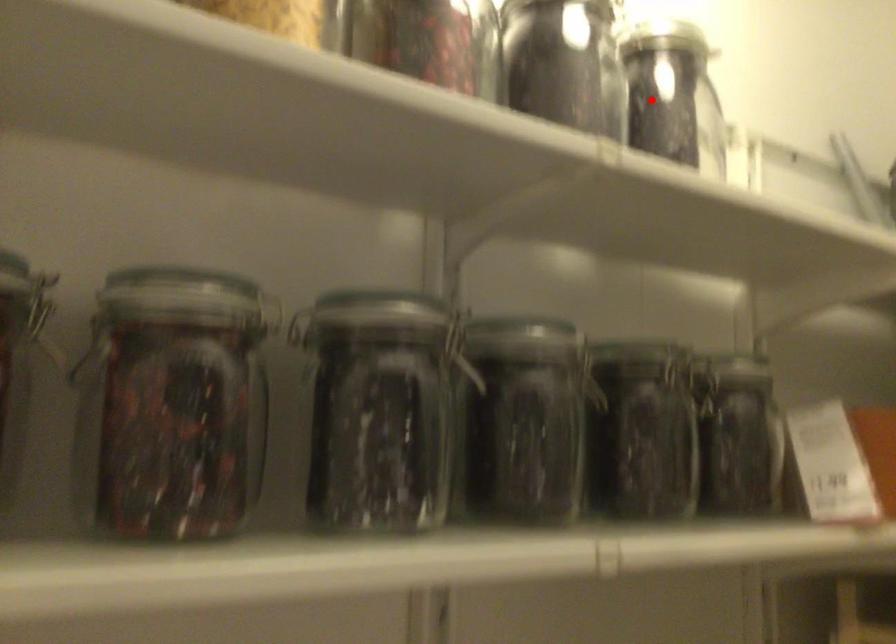
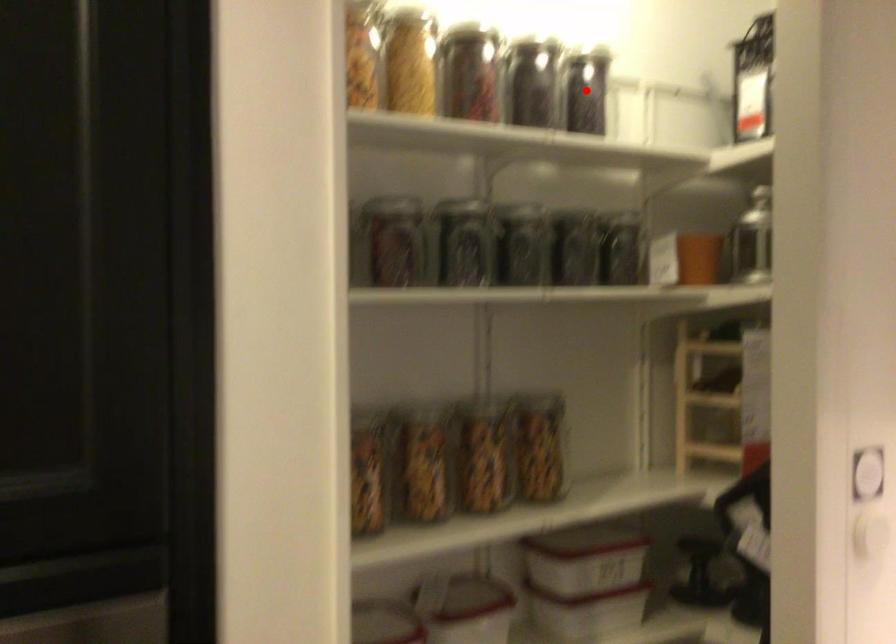
I am providing you with two images of the same scene from different viewpoints. A red point is marked on the first image and another point is marked on the second image. Is the red point in image1 aligned with the point shown in image2?

Yes